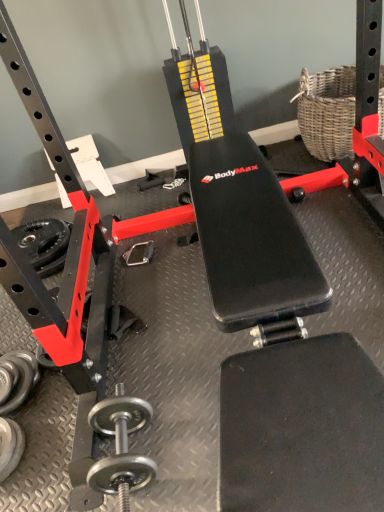
Locate an element on the screen. The width and height of the screenshot is (384, 512). spots to the right of silver metallic dumbbell at lower left, the 2th dumbbell positioned from the left is located at coordinates (44, 442).